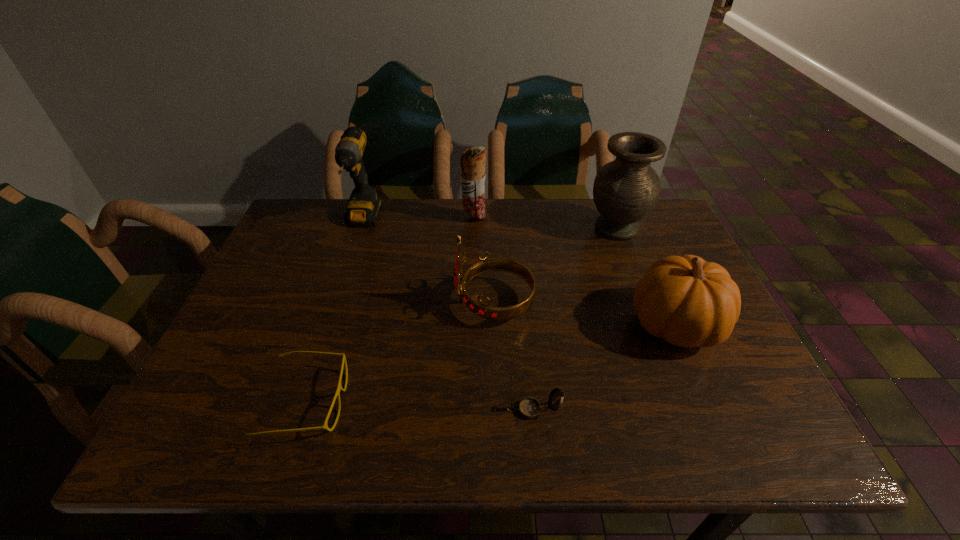
Identify the location of free location at the left edge of the desktop. The image size is (960, 540). (284, 255).

In the image, there is a desktop. At what (x,y) coordinates should I click in order to perform the action: click on free region at the far left corner. Please return your answer as a coordinate pair (x, y). This screenshot has width=960, height=540. Looking at the image, I should click on (317, 219).

I want to click on free space at the far right corner, so click(657, 225).

Find the location of `unoccupied area between the compass and the tiara`. unoccupied area between the compass and the tiara is located at coordinates (514, 356).

At what (x,y) coordinates should I click in order to perform the action: click on vacant space that is in between the spectacles and the vase. Please return your answer as a coordinate pair (x, y). Image resolution: width=960 pixels, height=540 pixels. Looking at the image, I should click on (462, 315).

I want to click on free space between the drill and the vase, so click(490, 225).

Where is `free space between the drill and the burrito`? The width and height of the screenshot is (960, 540). free space between the drill and the burrito is located at coordinates (419, 219).

The width and height of the screenshot is (960, 540). Identify the location of vacant space in between the spectacles and the tiara. (400, 352).

Where is `free space between the compass and the pumpkin`? This screenshot has height=540, width=960. free space between the compass and the pumpkin is located at coordinates (x=604, y=367).

Identify the location of free spot between the pumpkin and the burrito. (574, 271).